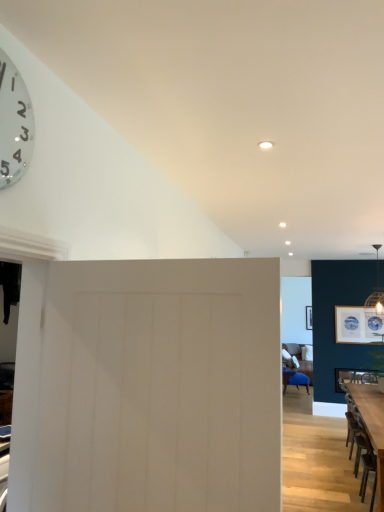
What do you see at coordinates (14, 124) in the screenshot? The image size is (384, 512). I see `metallic silver clock at upper left` at bounding box center [14, 124].

At what (x,y) coordinates should I click in order to perform the action: click on white matte door at center. Please return your answer as a coordinate pair (x, y). Looking at the image, I should click on (160, 386).

Based on the photo, what is the approximate height of matte white picture frame at upper right?

25.53 inches.

This screenshot has width=384, height=512. In order to click on metallic silver clock at upper left in this screenshot , I will do `click(14, 124)`.

Who is taller, matte white picture frame at upper right or metallic silver clock at upper left?

matte white picture frame at upper right.

Image resolution: width=384 pixels, height=512 pixels. In the image, there is a matte white picture frame at upper right. In order to click on wall clock above it (from the image's perspective) in this screenshot , I will do `click(14, 124)`.

Is matte white picture frame at upper right not close to metallic silver clock at upper left?

Yes, matte white picture frame at upper right and metallic silver clock at upper left are quite far apart.

Considering the points (367, 337) and (16, 128), which point is behind, point (367, 337) or point (16, 128)?

The point (367, 337) is behind.

Measure the distance between metallic silver clock at upper left and white matte door at center.

28.44 inches.

Between metallic silver clock at upper left and white matte door at center, which one has less height?

metallic silver clock at upper left.

Where is `wall clock above the white matte door at center (from the image's perspective)`? wall clock above the white matte door at center (from the image's perspective) is located at coordinates click(14, 124).

Looking at this image, is metallic silver clock at upper left oriented towards white matte door at center?

No, metallic silver clock at upper left is not aimed at white matte door at center.

In the image, there is a matte white picture frame at upper right. Identify the location of wall clock above it (from the image's perspective). (14, 124).

In the scene shown: Is metallic silver clock at upper left turned away from matte white picture frame at upper right?

metallic silver clock at upper left does not have its back to matte white picture frame at upper right.

Considering the points (17, 125) and (358, 307), which point is behind, point (17, 125) or point (358, 307)?

The point (358, 307) is behind.

Is wooden table at lower right not near matte white picture frame at upper right?

wooden table at lower right is far away from matte white picture frame at upper right.

Considering the sizes of objects wooden table at lower right and matte white picture frame at upper right in the image provided, who is wider, wooden table at lower right or matte white picture frame at upper right?

Wider between the two is wooden table at lower right.

You are a GUI agent. You are given a task and a screenshot of the screen. Output one action in this format:
    pyautogui.click(x=<x>, y=<y>)
    Task: Click on the table that appears below the matte white picture frame at upper right (from the image's perspective)
    The image size is (384, 512).
    Given the screenshot: What is the action you would take?
    pyautogui.click(x=372, y=425)

Consider the image. Is wooden table at lower right inside the boundaries of matte white picture frame at upper right, or outside?

wooden table at lower right lies outside matte white picture frame at upper right.

Is white matte door at center facing away from matte white picture frame at upper right?

No, matte white picture frame at upper right is not at the back of white matte door at center.

Can you confirm if white matte door at center is taller than matte white picture frame at upper right?

Yes, white matte door at center is taller than matte white picture frame at upper right.

Is white matte door at center inside the boundaries of matte white picture frame at upper right, or outside?

white matte door at center is located beyond the bounds of matte white picture frame at upper right.

At what (x,y) coordinates should I click in order to perform the action: click on picture frame behind the white matte door at center. Please return your answer as a coordinate pair (x, y). Looking at the image, I should click on pyautogui.click(x=358, y=325).

From the image's perspective, does white matte door at center appear higher than metallic silver clock at upper left?

No, from the image's perspective, white matte door at center is not on top of metallic silver clock at upper left.

How different are the orientations of white matte door at center and metallic silver clock at upper left in degrees?

The angular difference between white matte door at center and metallic silver clock at upper left is 83.8 degrees.

Is white matte door at center aimed at metallic silver clock at upper left?

No.

Between white matte door at center and metallic silver clock at upper left, which one has larger size?

Bigger between the two is white matte door at center.

Based on their sizes in the image, would you say white matte door at center is bigger or smaller than wooden table at lower right?

In the image, white matte door at center appears to be smaller than wooden table at lower right.

In the image, is white matte door at center on the left side or the right side of wooden table at lower right?

In the image, white matte door at center appears on the left side of wooden table at lower right.

Does white matte door at center have a lesser width compared to wooden table at lower right?

Correct, the width of white matte door at center is less than that of wooden table at lower right.

Find the location of a particular element. The width and height of the screenshot is (384, 512). table on the right of white matte door at center is located at coordinates click(x=372, y=425).

Identify the location of wall clock that appears above the matte white picture frame at upper right (from a real-world perspective). (14, 124).

The width and height of the screenshot is (384, 512). In order to click on wall clock that is on the left side of white matte door at center in this screenshot , I will do `click(14, 124)`.

When comparing their distances from wooden table at lower right, does matte white picture frame at upper right or white matte door at center seem further?

white matte door at center is positioned further to the anchor wooden table at lower right.

Looking at the image, which one is located closer to metallic silver clock at upper left, white matte door at center or matte white picture frame at upper right?

Among the two, white matte door at center is located nearer to metallic silver clock at upper left.

Considering their positions, is matte white picture frame at upper right positioned closer to white matte door at center than wooden table at lower right?

wooden table at lower right lies closer to white matte door at center than the other object.

When comparing their distances from wooden table at lower right, does metallic silver clock at upper left or matte white picture frame at upper right seem closer?

matte white picture frame at upper right lies closer to wooden table at lower right than the other object.

Estimate the real-world distances between objects in this image. Which object is further from wooden table at lower right, metallic silver clock at upper left or white matte door at center?

metallic silver clock at upper left is further to wooden table at lower right.

Estimate the real-world distances between objects in this image. Which object is closer to metallic silver clock at upper left, matte white picture frame at upper right or white matte door at center?

white matte door at center is closer to metallic silver clock at upper left.

Which object lies further to the anchor point white matte door at center, matte white picture frame at upper right or metallic silver clock at upper left?

matte white picture frame at upper right is further to white matte door at center.

When comparing their distances from metallic silver clock at upper left, does wooden table at lower right or matte white picture frame at upper right seem further?

Based on the image, matte white picture frame at upper right appears to be further to metallic silver clock at upper left.

At what (x,y) coordinates should I click in order to perform the action: click on wall clock between white matte door at center and matte white picture frame at upper right in the front-back direction. Please return your answer as a coordinate pair (x, y). The height and width of the screenshot is (512, 384). Looking at the image, I should click on (14, 124).

This screenshot has height=512, width=384. What are the coordinates of `door located between metallic silver clock at upper left and wooden table at lower right in the left-right direction` in the screenshot? It's located at (160, 386).

This screenshot has height=512, width=384. What are the coordinates of `table between white matte door at center and matte white picture frame at upper right along the z-axis` in the screenshot? It's located at (372, 425).

This screenshot has height=512, width=384. Find the location of `table between metallic silver clock at upper left and matte white picture frame at upper right along the z-axis`. table between metallic silver clock at upper left and matte white picture frame at upper right along the z-axis is located at coordinates (372, 425).